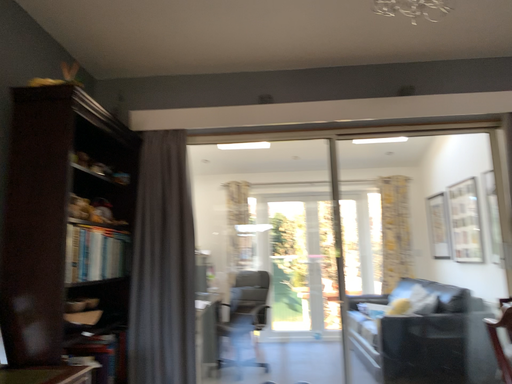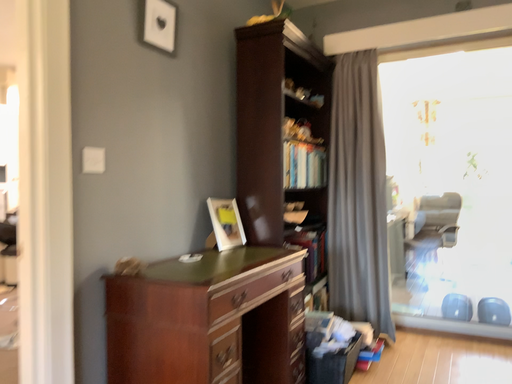
Question: Which way did the camera rotate in the video?

Choices:
 (A) rotated left
 (B) rotated right

Answer: (A)